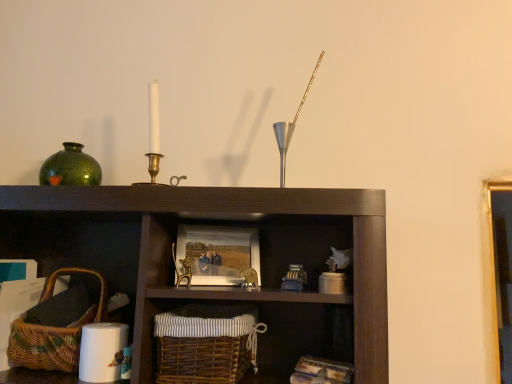
What is the approximate height of wooden picture frame at center?

4.50 inches.

Locate an element on the screen. This screenshot has width=512, height=384. wooden picture frame at center is located at coordinates (218, 253).

Describe the element at coordinates (206, 343) in the screenshot. The width and height of the screenshot is (512, 384). I see `woven brown basket at lower center, placed as the 1th basket when sorted from right to left` at that location.

The image size is (512, 384). In order to click on woven brown basket at lower center, placed as the 1th basket when sorted from right to left in this screenshot , I will do `click(206, 343)`.

Where is `green glossy vase at upper left`? This screenshot has height=384, width=512. green glossy vase at upper left is located at coordinates (70, 168).

Based on the photo, which of these two, green glossy vase at upper left or woven brown basket at lower left, which appears as the 2th basket when viewed from the right, stands taller?

With more height is woven brown basket at lower left, which appears as the 2th basket when viewed from the right.

Could you tell me if green glossy vase at upper left is facing woven brown basket at lower left, which appears as the 2th basket when viewed from the right?

No, green glossy vase at upper left is not turned towards woven brown basket at lower left, which appears as the 2th basket when viewed from the right.

Considering the sizes of green glossy vase at upper left and woven brown basket at lower left, which appears as the 2th basket when viewed from the right, in the image, is green glossy vase at upper left wider or thinner than woven brown basket at lower left, which appears as the 2th basket when viewed from the right,?

Considering their sizes, green glossy vase at upper left looks slimmer than woven brown basket at lower left, which appears as the 2th basket when viewed from the right.

There is a green glossy vase at upper left. What are the coordinates of `the 1st basket below it (from the image's perspective)` in the screenshot? It's located at (42, 346).

Where is `glass vase on the left side of metallic silver candle holder at upper center`? The height and width of the screenshot is (384, 512). glass vase on the left side of metallic silver candle holder at upper center is located at coordinates (70, 168).

Which object is wider, metallic silver candle holder at upper center or green glossy vase at upper left?

green glossy vase at upper left.

Is metallic silver candle holder at upper center placed right next to green glossy vase at upper left?

metallic silver candle holder at upper center is not next to green glossy vase at upper left, and they're not touching.

Which is further, (283,171) or (49,168)?

The point (49,168) is farther.

Identify the location of the 2nd basket counting from the left of the metallic silver candle holder at upper center. (42, 346).

Is point (28, 347) farther from viewer compared to point (289, 124)?

That is False.

Is woven brown basket at lower left, which appears as the 2th basket when viewed from the right, facing towards metallic silver candle holder at upper center?

No.

Considering the sizes of woven brown basket at lower left, the 1th basket viewed from the left, and metallic silver candle holder at upper center in the image, is woven brown basket at lower left, the 1th basket viewed from the left, wider or thinner than metallic silver candle holder at upper center?

Clearly, woven brown basket at lower left, the 1th basket viewed from the left, has more width compared to metallic silver candle holder at upper center.

In the image, is woven brown basket at lower left, which appears as the 2th basket when viewed from the right, positioned in front of or behind wooden picture frame at center?

Clearly, woven brown basket at lower left, which appears as the 2th basket when viewed from the right, is in front of wooden picture frame at center.

Is woven brown basket at lower left, which appears as the 2th basket when viewed from the right, oriented away from wooden picture frame at center?

No.

Which of these two, woven brown basket at lower left, which appears as the 2th basket when viewed from the right, or wooden picture frame at center, is bigger?

woven brown basket at lower left, which appears as the 2th basket when viewed from the right.

From the image's perspective, which one is positioned higher, woven brown basket at lower left, the 1th basket viewed from the left, or wooden picture frame at center?

wooden picture frame at center appears higher in the image.

From the metallic silver candle holder at upper center, count 2nd baskets forward and point to it. Please provide its 2D coordinates.

[(206, 343)]

Would you say woven brown basket at lower center, placed as the 1th basket when sorted from right to left, is outside metallic silver candle holder at upper center?

Yes, woven brown basket at lower center, placed as the 1th basket when sorted from right to left, is outside of metallic silver candle holder at upper center.

Measure the distance between woven brown basket at lower center, the second basket viewed from the left, and metallic silver candle holder at upper center.

A distance of 14.52 inches exists between woven brown basket at lower center, the second basket viewed from the left, and metallic silver candle holder at upper center.

Does point (234, 321) come behind point (319, 58)?

No, (234, 321) is in front of (319, 58).

From the image's perspective, is woven brown basket at lower left, the 1th basket viewed from the left, above woven brown basket at lower center, placed as the 1th basket when sorted from right to left?

Yes, from the image's perspective, woven brown basket at lower left, the 1th basket viewed from the left, is over woven brown basket at lower center, placed as the 1th basket when sorted from right to left.

Does woven brown basket at lower left, the 1th basket viewed from the left, lie in front of woven brown basket at lower center, the second basket viewed from the left?

No, it is behind woven brown basket at lower center, the second basket viewed from the left.

Does point (53, 335) come closer to viewer compared to point (160, 370)?

That is False.

Considering the sizes of objects woven brown basket at lower left, which appears as the 2th basket when viewed from the right, and woven brown basket at lower center, placed as the 1th basket when sorted from right to left, in the image provided, who is shorter, woven brown basket at lower left, which appears as the 2th basket when viewed from the right, or woven brown basket at lower center, placed as the 1th basket when sorted from right to left,?

woven brown basket at lower center, placed as the 1th basket when sorted from right to left, is shorter.

From a real-world perspective, who is located lower, woven brown basket at lower center, the second basket viewed from the left, or woven brown basket at lower left, which appears as the 2th basket when viewed from the right?

woven brown basket at lower center, the second basket viewed from the left, from a real-world perspective.

The width and height of the screenshot is (512, 384). In order to click on basket below the woven brown basket at lower left, the 1th basket viewed from the left (from a real-world perspective) in this screenshot , I will do `click(206, 343)`.

Can you confirm if woven brown basket at lower center, the second basket viewed from the left, is wider than woven brown basket at lower left, the 1th basket viewed from the left?

Correct, the width of woven brown basket at lower center, the second basket viewed from the left, exceeds that of woven brown basket at lower left, the 1th basket viewed from the left.

In order to click on basket that is the 1st one below the green glossy vase at upper left (from a real-world perspective) in this screenshot , I will do `click(42, 346)`.

Locate an element on the screen. candle holder positioned vertically above the green glossy vase at upper left (from a real-world perspective) is located at coordinates (291, 127).

Considering their positions, is wooden picture frame at center positioned closer to green glossy vase at upper left than metallic silver candle holder at upper center?

wooden picture frame at center is closer to green glossy vase at upper left.

Estimate the real-world distances between objects in this image. Which object is closer to woven brown basket at lower left, which appears as the 2th basket when viewed from the right, woven brown basket at lower center, the second basket viewed from the left, or green glossy vase at upper left?

woven brown basket at lower center, the second basket viewed from the left, is closer to woven brown basket at lower left, which appears as the 2th basket when viewed from the right.

Considering their positions, is green glossy vase at upper left positioned further to woven brown basket at lower center, the second basket viewed from the left, than metallic silver candle holder at upper center?

Based on the image, green glossy vase at upper left appears to be further to woven brown basket at lower center, the second basket viewed from the left.

Which object lies further to the anchor point green glossy vase at upper left, woven brown basket at lower center, the second basket viewed from the left, or metallic silver candle holder at upper center?

metallic silver candle holder at upper center lies further to green glossy vase at upper left than the other object.

Based on their spatial positions, is wooden picture frame at center or woven brown basket at lower center, the second basket viewed from the left, further from green glossy vase at upper left?

Based on the image, woven brown basket at lower center, the second basket viewed from the left, appears to be further to green glossy vase at upper left.

Estimate the real-world distances between objects in this image. Which object is further from wooden picture frame at center, green glossy vase at upper left or woven brown basket at lower left, the 1th basket viewed from the left?

green glossy vase at upper left.

Which object lies nearer to the anchor point metallic silver candle holder at upper center, green glossy vase at upper left or wooden picture frame at center?

wooden picture frame at center is positioned closer to the anchor metallic silver candle holder at upper center.

Looking at the image, which one is located further to woven brown basket at lower left, the 1th basket viewed from the left, woven brown basket at lower center, placed as the 1th basket when sorted from right to left, or metallic silver candle holder at upper center?

Among the two, metallic silver candle holder at upper center is located further to woven brown basket at lower left, the 1th basket viewed from the left.

Find the location of a particular element. The width and height of the screenshot is (512, 384). basket situated between woven brown basket at lower left, the 1th basket viewed from the left, and wooden picture frame at center from left to right is located at coordinates (206, 343).

This screenshot has height=384, width=512. Identify the location of picture frame between woven brown basket at lower left, which appears as the 2th basket when viewed from the right, and metallic silver candle holder at upper center. (218, 253).

Identify the location of picture frame between green glossy vase at upper left and metallic silver candle holder at upper center. The height and width of the screenshot is (384, 512). (218, 253).

At what (x,y) coordinates should I click in order to perform the action: click on basket between green glossy vase at upper left and woven brown basket at lower center, the second basket viewed from the left, from top to bottom. Please return your answer as a coordinate pair (x, y). The height and width of the screenshot is (384, 512). Looking at the image, I should click on (42, 346).